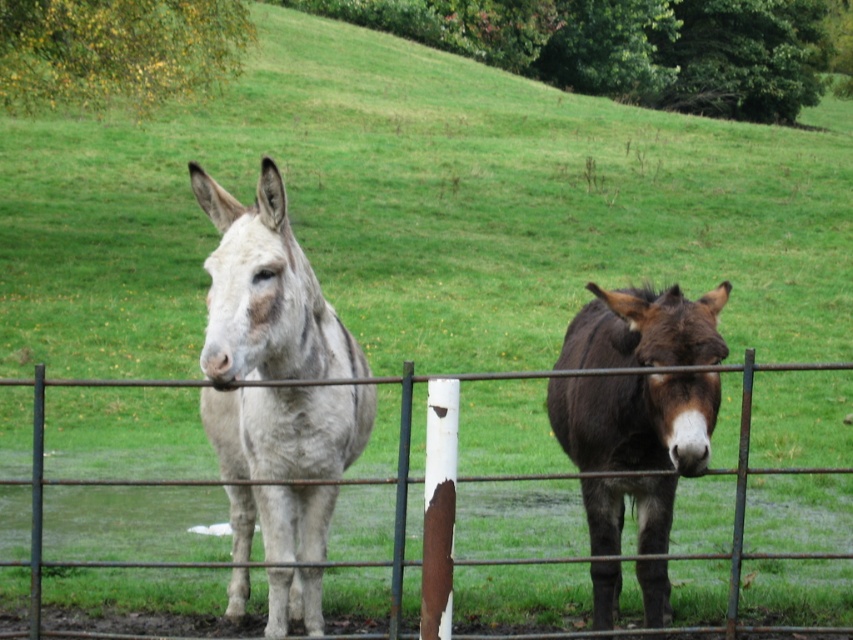
Is white speckled fur mule at center taller than brown fuzzy mule at right?

Yes.

Which of these two, white speckled fur mule at center or brown fuzzy mule at right, stands taller?

With more height is white speckled fur mule at center.

Which is in front, point (294, 435) or point (579, 387)?

Point (294, 435) is more forward.

Identify the location of white speckled fur mule at center. This screenshot has height=640, width=853. (274, 346).

Who is positioned more to the right, white speckled fur mule at center or rusty metal fence at center?

Positioned to the right is rusty metal fence at center.

Does white speckled fur mule at center have a lesser width compared to rusty metal fence at center?

In fact, white speckled fur mule at center might be wider than rusty metal fence at center.

Does point (227, 408) come closer to viewer compared to point (375, 477)?

Yes, it is.

Find the location of a particular element. This screenshot has height=640, width=853. white speckled fur mule at center is located at coordinates (274, 346).

Who is higher up, brown fuzzy mule at right or rusty metal fence at center?

rusty metal fence at center

Which is more to the right, brown fuzzy mule at right or rusty metal fence at center?

Positioned to the right is brown fuzzy mule at right.

Does point (616, 524) lie in front of point (404, 420)?

That is False.

The height and width of the screenshot is (640, 853). What are the coordinates of `brown fuzzy mule at right` in the screenshot? It's located at (633, 445).